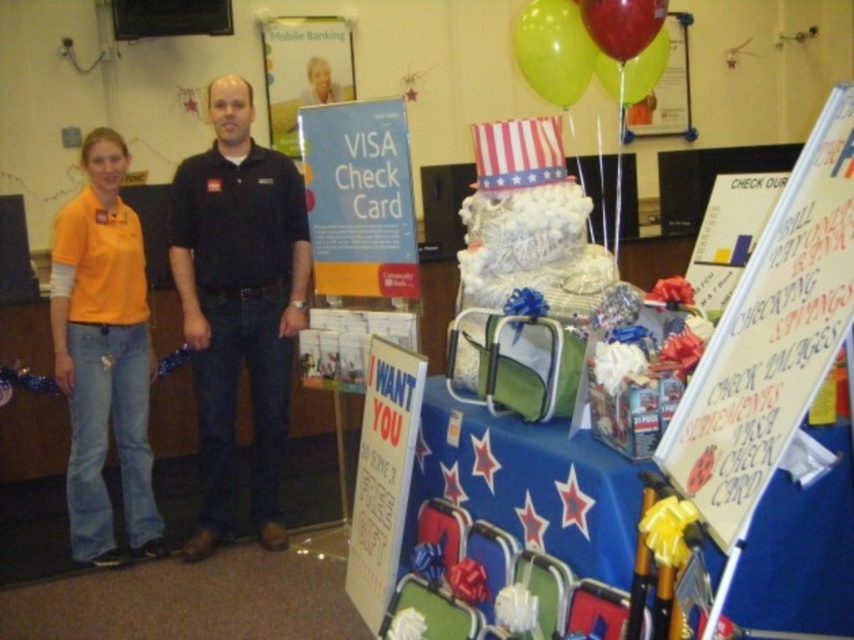
Question: Which point is farther to the camera?

Choices:
 (A) click(592, 24)
 (B) click(560, 19)

Answer: (B)

Question: Can you confirm if black cotton shirt at center is positioned below green rubber balloon at upper center?

Choices:
 (A) no
 (B) yes

Answer: (B)

Question: Which point appears farthest from the camera in this image?

Choices:
 (A) (132, 499)
 (B) (617, 13)
 (C) (209, 493)
 (D) (635, 481)

Answer: (A)

Question: Is shiny metallic balloon at upper center positioned behind red glossy balloon at upper center?

Choices:
 (A) no
 (B) yes

Answer: (A)

Question: Does green rubber balloon at upper center come in front of red glossy balloon at upper center?

Choices:
 (A) yes
 (B) no

Answer: (B)

Question: Which object is closer to the camera taking this photo?

Choices:
 (A) blue fabric table at center
 (B) shiny metallic balloon at upper center

Answer: (A)